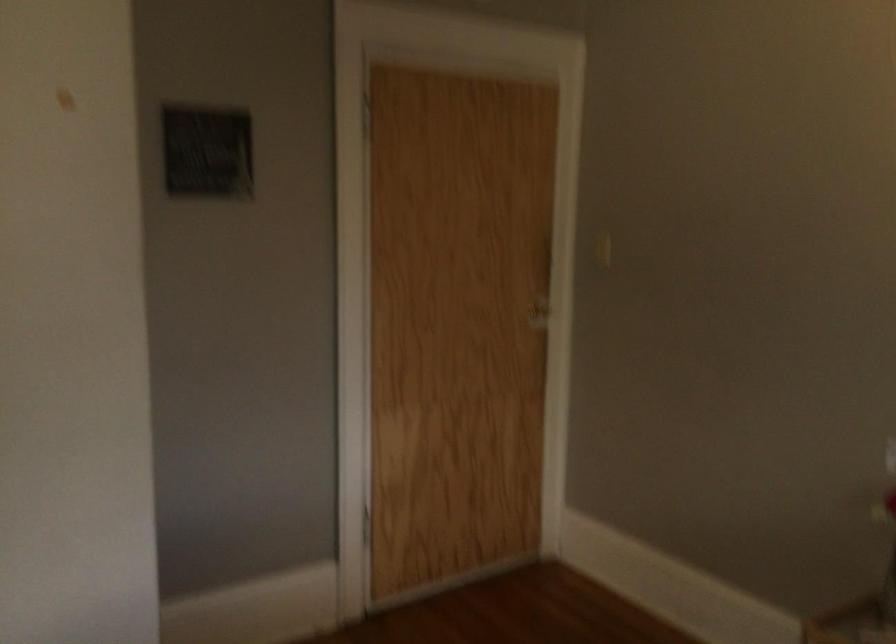
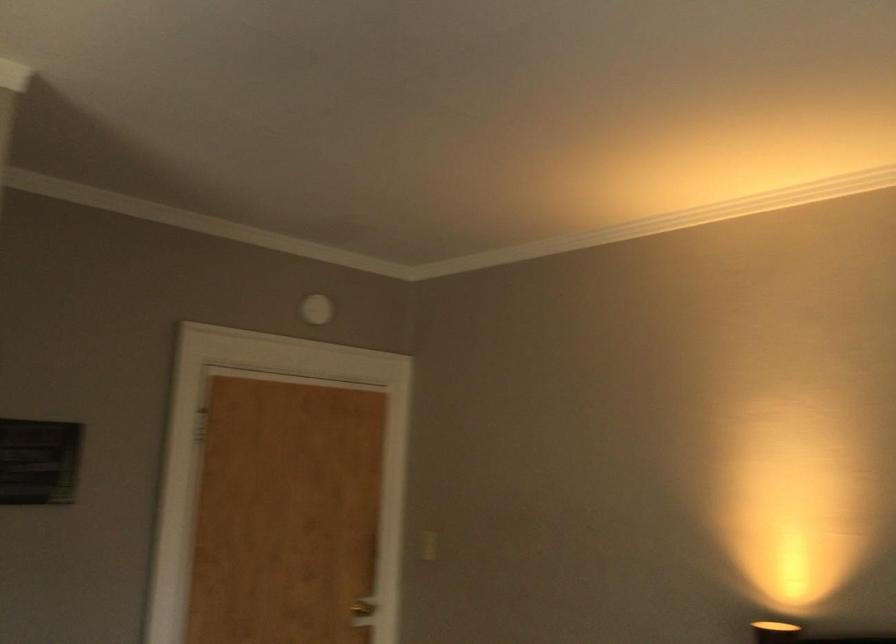
Where in the second image is the point corresponding to (533,317) from the first image?

(362, 612)